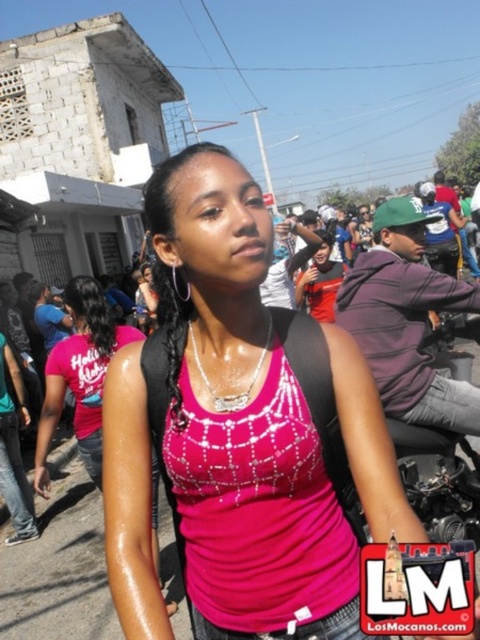
In the scene, there are two clothing items at the center of the image, a pink fabric tank top at center and a matte red shirt at center. Which clothing item has a taller appearance?

The pink fabric tank top at center has a greater height compared to the matte red shirt at center, so the pink fabric tank top at center is taller.